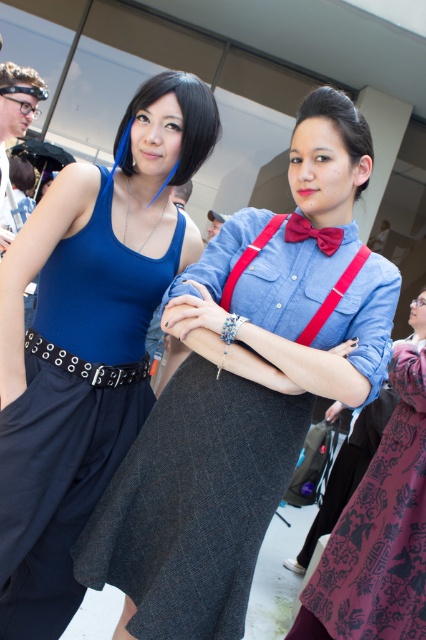
You are a photographer at the event and need to ensure both the matte blue dress at center and the smooth brown hair at center are clearly visible in your photo. Given their sizes, which object should you focus on first to ensure proper framing?

The matte blue dress at center is larger in size than the smooth brown hair at center, so you should focus on the matte blue dress at center first to ensure proper framing since it occupies more space in the composition.

You are a photographer at the event and want to ensure that both the matte blue dress at center and the smooth brown hair at center are visible in your photo. Based on their positions, which one should you focus on first to capture both elements effectively?

The matte blue dress at center is below smooth brown hair at center, so focusing on the smooth brown hair at center first will ensure both elements are in frame.